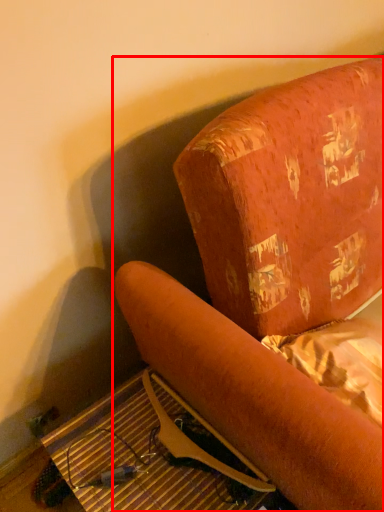
Question: Considering the relative positions of furniture (annotated by the red box) and table in the image provided, where is furniture (annotated by the red box) located with respect to the staircase?

Choices:
 (A) left
 (B) right

Answer: (B)